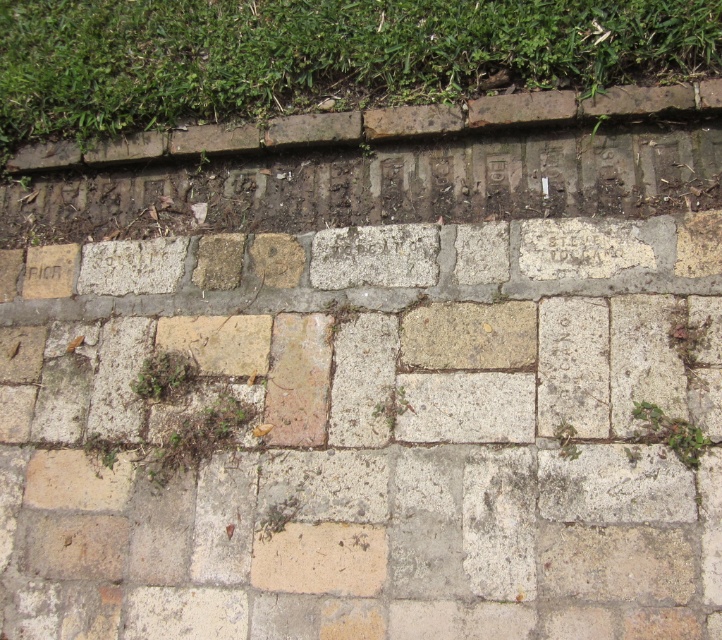
Does natural stone pavement at center have a greater width compared to green mossy patch at center?

Yes, natural stone pavement at center is wider than green mossy patch at center.

Between natural stone pavement at center and green mossy patch at center, which one appears on the left side from the viewer's perspective?

natural stone pavement at center is more to the left.

Is point (165, 522) behind point (666, 428)?

Yes, point (165, 522) is farther from viewer.

Locate an element on the screen. The image size is (722, 640). natural stone pavement at center is located at coordinates (370, 440).

Which is behind, point (226, 317) or point (56, 252)?

Positioned behind is point (56, 252).

Which is in front, point (180, 337) or point (51, 268)?

Point (180, 337)

Identify the location of beige stone brick at center. (219, 340).

You are a GUI agent. You are given a task and a screenshot of the screen. Output one action in this format:
    pyautogui.click(x=<x>, y=<y>)
    Task: Click on the green grass at upper center
    The image size is (722, 640).
    Given the screenshot: What is the action you would take?
    pyautogui.click(x=318, y=54)

Between green grass at upper center and light brown stone brick at center, which one appears on the right side from the viewer's perspective?

From the viewer's perspective, light brown stone brick at center appears more on the right side.

The height and width of the screenshot is (640, 722). What do you see at coordinates (318, 54) in the screenshot?
I see `green grass at upper center` at bounding box center [318, 54].

You are a GUI agent. You are given a task and a screenshot of the screen. Output one action in this format:
    pyautogui.click(x=<x>, y=<y>)
    Task: Click on the green grass at upper center
    
    Given the screenshot: What is the action you would take?
    pyautogui.click(x=318, y=54)